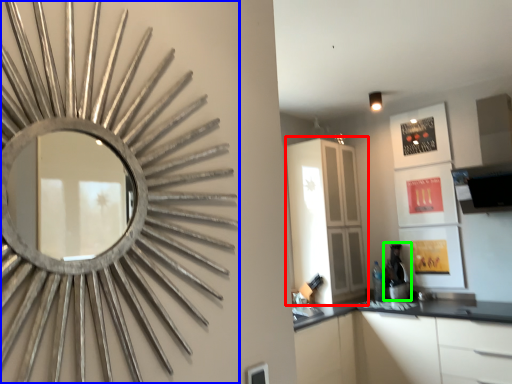
Question: Considering the real-world distances, which object is closest to dresser (highlighted by a red box)? oval (highlighted by a blue box) or coffee machine (highlighted by a green box).

Choices:
 (A) oval
 (B) coffee machine

Answer: (B)